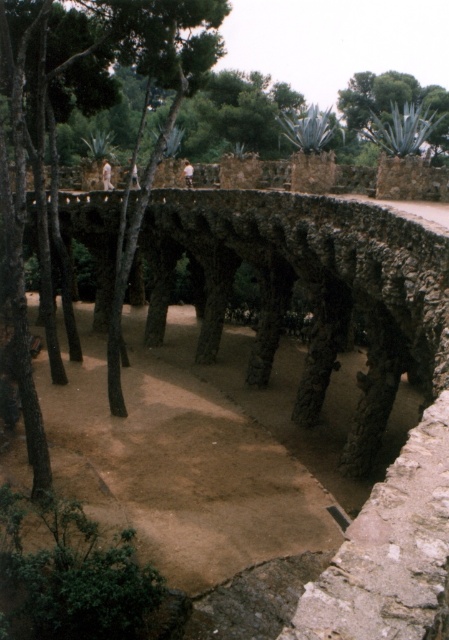
You are a visitor standing on the ground near the rustic stone bridge at center and the white matte shirt at upper center. Which object is taller?

The rustic stone bridge at center is taller than the white matte shirt at upper center.